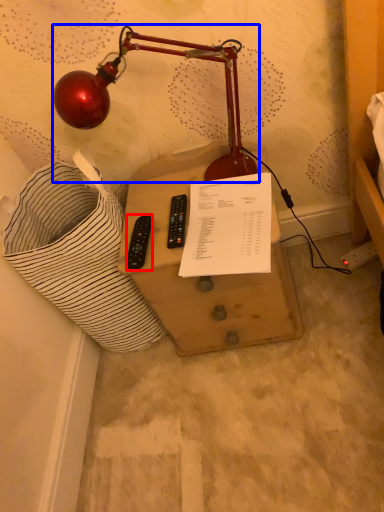
Question: Which of the following is the farthest to the observer, control (highlighted by a red box) or lamp (highlighted by a blue box)?

Choices:
 (A) control
 (B) lamp

Answer: (A)